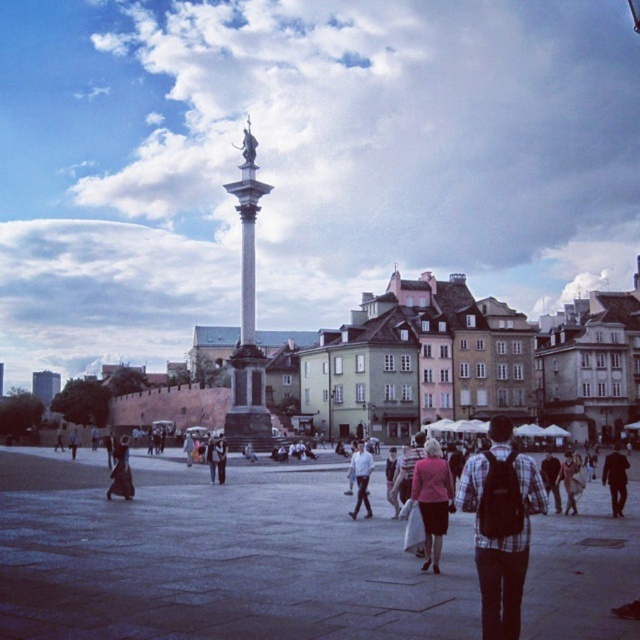
You are a photographer standing in the square and want to capture both the white cotton shirt at center and the light brown leather jacket at lower right in the same frame. Which object should you focus on first to ensure both are in the frame?

You should focus on the white cotton shirt at center first because it is wider than the light brown leather jacket at lower right, so capturing it first ensures the entire jacket will also fit into the frame.

You are a photographer trying to capture both the plaid fabric shirt at center and the dark brown leather coat at lower left in a single frame. Which object should you focus on first to ensure both are in the frame?

You should focus on the plaid fabric shirt at center first since it is larger in size than the dark brown leather coat at lower left, ensuring it fits within the frame while adjusting for the smaller coat.